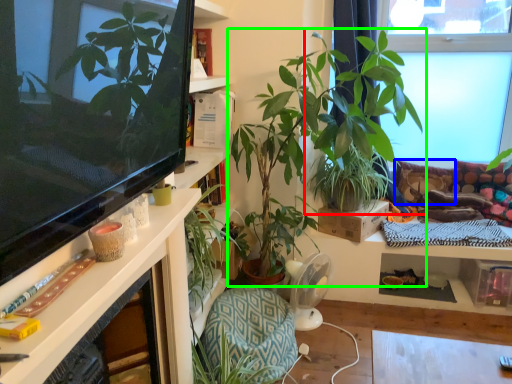
Question: Estimate the real-world distances between objects in this image. Which object is farther from houseplant (highlighted by a red box), pillow (highlighted by a blue box) or houseplant (highlighted by a green box)?

Choices:
 (A) pillow
 (B) houseplant

Answer: (A)